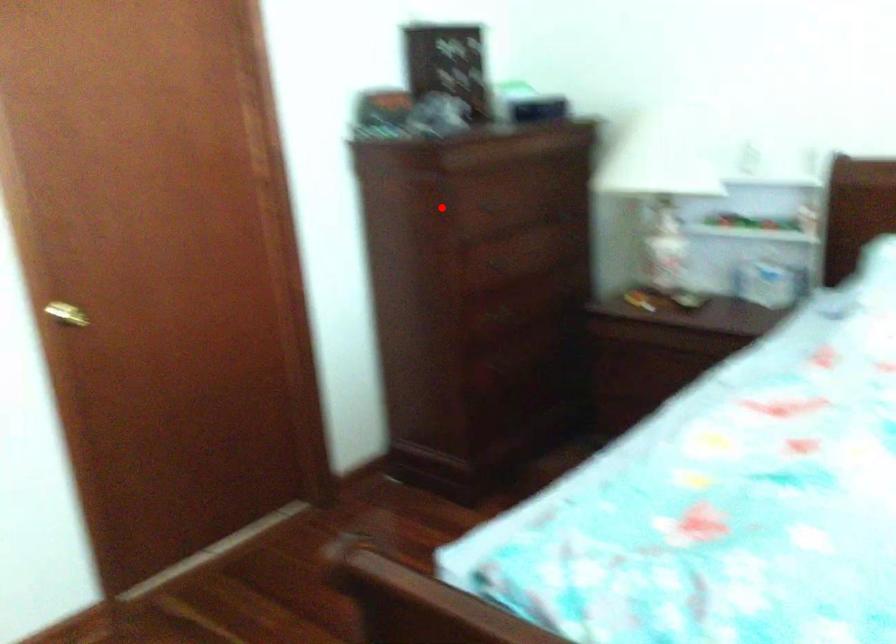
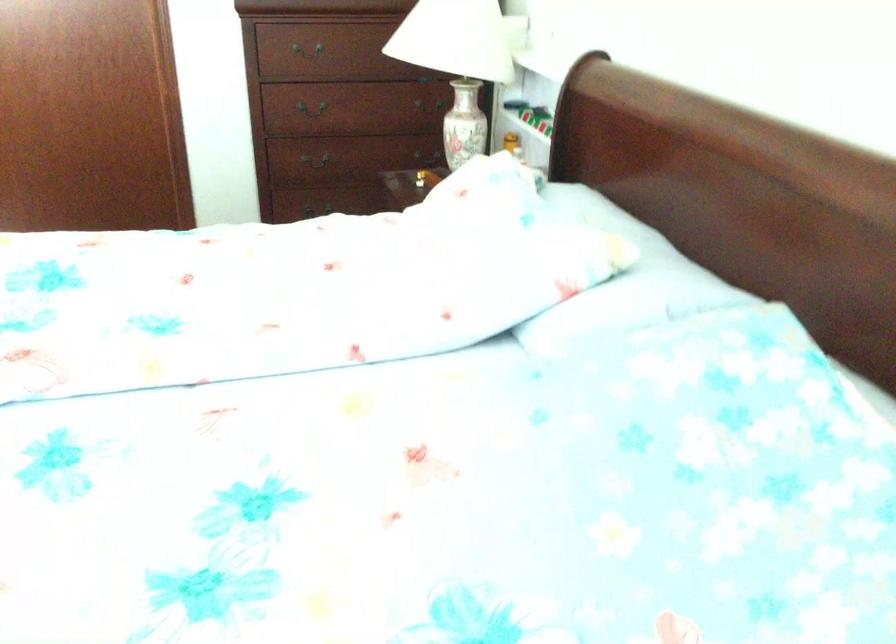
Where in the second image is the point corresponding to the highlighted location from the first image?

(309, 52)